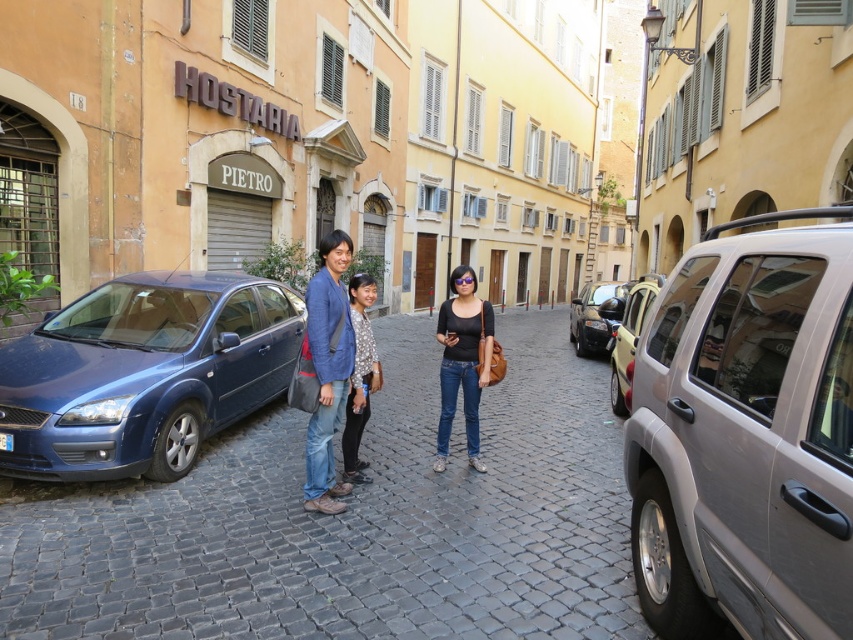
Can you confirm if silver metallic minivan at right is taller than patterned fabric blouse at center?

Correct, silver metallic minivan at right is much taller as patterned fabric blouse at center.

Is point (840, 420) positioned in front of point (363, 419)?

Yes, point (840, 420) is closer to viewer.

Is point (773, 461) closer to viewer compared to point (357, 310)?

Yes, it is.

Image resolution: width=853 pixels, height=640 pixels. Find the location of `silver metallic minivan at right`. silver metallic minivan at right is located at coordinates (747, 436).

Which is more to the right, denim jacket at center or patterned fabric blouse at center?

Positioned to the right is patterned fabric blouse at center.

Can you confirm if denim jacket at center is positioned to the left of patterned fabric blouse at center?

Correct, you'll find denim jacket at center to the left of patterned fabric blouse at center.

Between point (305, 461) and point (361, 404), which one is positioned behind?

The point (305, 461) is behind.

The height and width of the screenshot is (640, 853). In order to click on denim jacket at center in this screenshot , I will do `click(328, 371)`.

Can you confirm if black matte shirt at center is thinner than metallic silver car at center right?

Indeed, black matte shirt at center has a lesser width compared to metallic silver car at center right.

Between black matte shirt at center and metallic silver car at center right, which one appears on the right side from the viewer's perspective?

Positioned to the right is metallic silver car at center right.

Between point (474, 298) and point (654, 292), which one is positioned in front?

Point (474, 298)

Where is `black matte shirt at center`? Image resolution: width=853 pixels, height=640 pixels. black matte shirt at center is located at coordinates (463, 362).